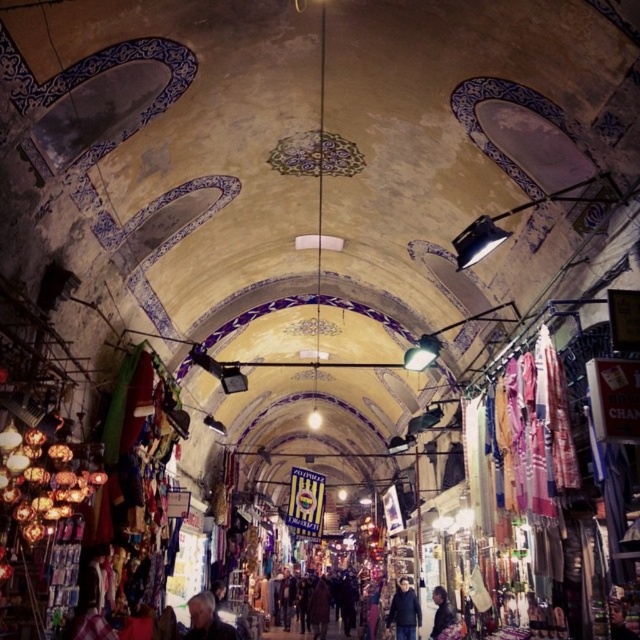
In the scene shown: How far apart are gray fabric jacket at lower center and dark brown leather jacket at lower right?

A distance of 20.62 meters exists between gray fabric jacket at lower center and dark brown leather jacket at lower right.

Consider the image. Is the position of gray fabric jacket at lower center more distant than that of dark brown leather jacket at lower right?

No, gray fabric jacket at lower center is closer to the viewer.

Is point (186, 602) less distant than point (433, 630)?

No, it is behind (433, 630).

Where is `gray fabric jacket at lower center`? The image size is (640, 640). gray fabric jacket at lower center is located at coordinates (205, 620).

Is point (408, 630) in front of point (429, 636)?

No, it is not.

Between dark blue jacket at center and dark brown leather jacket at lower right, which one is positioned higher?

dark brown leather jacket at lower right is above.

Is point (403, 582) farther from viewer compared to point (433, 618)?

That is False.

The width and height of the screenshot is (640, 640). Find the location of `dark blue jacket at center`. dark blue jacket at center is located at coordinates (404, 611).

Does gray fabric jacket at lower center have a lesser height compared to dark blue jacket at center?

No.

Which is more to the right, gray fabric jacket at lower center or dark blue jacket at center?

dark blue jacket at center

The width and height of the screenshot is (640, 640). In order to click on gray fabric jacket at lower center in this screenshot , I will do `click(205, 620)`.